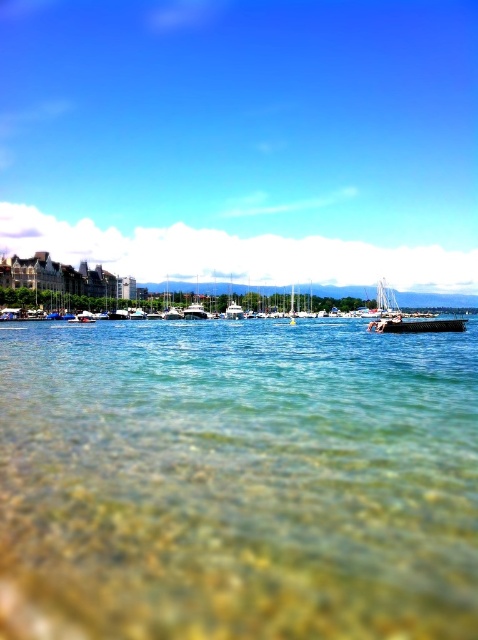
You are a marine biologist studying the coastal area. You observe the clear water at center and transparent water at center in the image. Which of these two waters covers a smaller area?

The clear water at center occupies less space than transparent water at center, so the clear water at center covers a smaller area.

Based on the photo, you are a marine biologist studying water clarity in the coastal area shown. You observe two distinct bodies of water in the scene, the clear water at center and the transparent water at center. Which one is farther away from the observer?

The clear water at center is farther away from the observer than the transparent water at center, as it is 404.35 feet away according to the description.

You are standing on the beach and want to cross the water to reach the floating platform on the right. The clear water at center and transparent water at center are in your path. Which body of water should you step into first to avoid getting too deep?

You should step into the clear water at center first because it is located to the left of the transparent water at center, and since the water transitions from shallow near the shore to deeper further out, stepping into the clear water first keeps you in shallower areas closer to the beach.